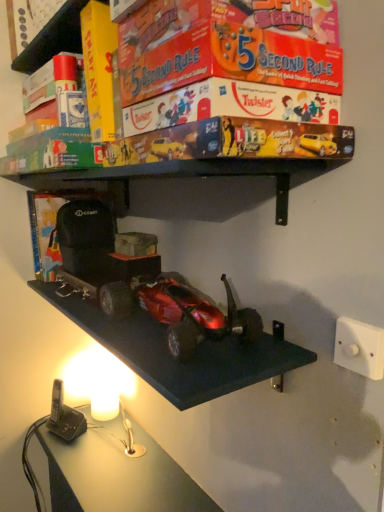
Question: Can you confirm if shiny metallic car at center is thinner than white plastic/light switch at lower right?

Choices:
 (A) no
 (B) yes

Answer: (A)

Question: Considering the relative sizes of shiny metallic car at center and white plastic/light switch at lower right in the image provided, is shiny metallic car at center smaller than white plastic/light switch at lower right?

Choices:
 (A) yes
 (B) no

Answer: (B)

Question: Is shiny metallic car at center taller than white plastic/light switch at lower right?

Choices:
 (A) yes
 (B) no

Answer: (A)

Question: From a real-world perspective, is shiny metallic car at center on top of white plastic/light switch at lower right?

Choices:
 (A) yes
 (B) no

Answer: (A)

Question: Is white plastic/light switch at lower right at the back of shiny metallic car at center?

Choices:
 (A) no
 (B) yes

Answer: (A)

Question: Considering their positions, is shiny metallic car at center located in front of or behind matt board game at upper center?

Choices:
 (A) behind
 (B) front

Answer: (A)

Question: In the image, is shiny metallic car at center on the left side or the right side of matt board game at upper center?

Choices:
 (A) right
 (B) left

Answer: (B)

Question: Considering the positions of point (208, 309) and point (218, 135), is point (208, 309) closer or farther from the camera than point (218, 135)?

Choices:
 (A) closer
 (B) farther

Answer: (B)

Question: In terms of size, does shiny metallic car at center appear bigger or smaller than matt board game at upper center?

Choices:
 (A) small
 (B) big

Answer: (A)

Question: From a real-world perspective, is white plastic/light switch at lower right above or below shiny metallic car at center?

Choices:
 (A) below
 (B) above

Answer: (A)

Question: Would you say white plastic/light switch at lower right is inside or outside shiny metallic car at center?

Choices:
 (A) outside
 (B) inside

Answer: (A)

Question: Considering their positions, is white plastic/light switch at lower right located in front of or behind shiny metallic car at center?

Choices:
 (A) behind
 (B) front

Answer: (B)

Question: From their relative heights in the image, would you say white plastic/light switch at lower right is taller or shorter than shiny metallic car at center?

Choices:
 (A) short
 (B) tall

Answer: (A)

Question: Would you say shiny metallic car at center is to the left or to the right of white plastic/light switch at lower right in the picture?

Choices:
 (A) left
 (B) right

Answer: (A)

Question: Is shiny metallic car at center in front of or behind white plastic/light switch at lower right in the image?

Choices:
 (A) front
 (B) behind

Answer: (B)